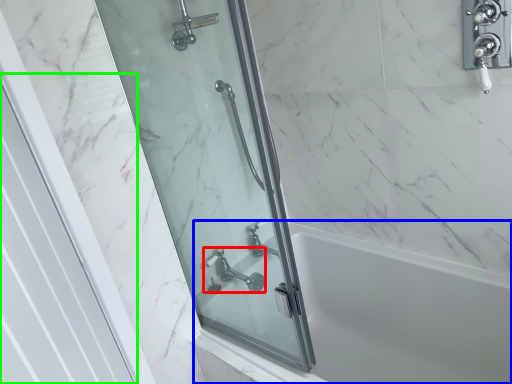
Question: Which object is positioned farthest from tap (highlighted by a red box)? Select from bath (highlighted by a blue box) and screen door (highlighted by a green box).

Choices:
 (A) bath
 (B) screen door

Answer: (B)